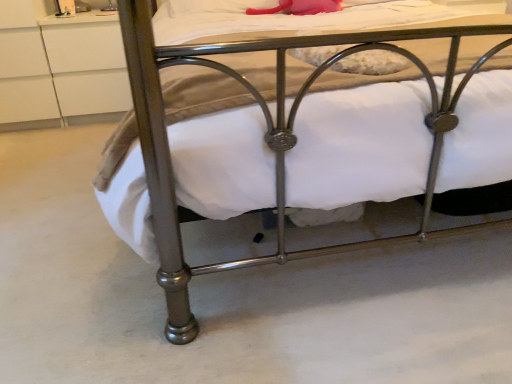
Where is `white matte drawer at upper left`? The height and width of the screenshot is (384, 512). white matte drawer at upper left is located at coordinates (87, 63).

What do you see at coordinates (87, 63) in the screenshot? I see `white matte drawer at upper left` at bounding box center [87, 63].

Describe the element at coordinates (265, 137) in the screenshot. The width and height of the screenshot is (512, 384). I see `metallic bed at lower center` at that location.

You are a GUI agent. You are given a task and a screenshot of the screen. Output one action in this format:
    pyautogui.click(x=<x>, y=<y>)
    Task: Click on the metallic bed at lower center
    This screenshot has height=384, width=512.
    Given the screenshot: What is the action you would take?
    pyautogui.click(x=265, y=137)

Locate an element on the screen. white matte drawer at upper left is located at coordinates (87, 63).

In the image, is metallic bed at lower center on the left side or the right side of white matte drawer at upper left?

Based on their positions, metallic bed at lower center is located to the right of white matte drawer at upper left.

Consider the image. Which object is further away from the camera taking this photo, metallic bed at lower center or white matte drawer at upper left?

Positioned behind is white matte drawer at upper left.

Between point (211, 267) and point (52, 51), which one is positioned behind?

The point (52, 51) is more distant.

From the image's perspective, which one is positioned higher, metallic bed at lower center or white matte drawer at upper left?

white matte drawer at upper left, from the image's perspective.

From a real-world perspective, is metallic bed at lower center above or below white matte drawer at upper left?

From a real-world perspective, metallic bed at lower center is physically above white matte drawer at upper left.

Can you confirm if metallic bed at lower center is wider than white matte drawer at upper left?

Indeed, metallic bed at lower center has a greater width compared to white matte drawer at upper left.

Which of these two, metallic bed at lower center or white matte drawer at upper left, stands taller?

metallic bed at lower center is taller.

Which of these two, metallic bed at lower center or white matte drawer at upper left, is bigger?

Bigger between the two is metallic bed at lower center.

Consider the image. Can we say metallic bed at lower center lies outside white matte drawer at upper left?

Yes, metallic bed at lower center is not within white matte drawer at upper left.

Is metallic bed at lower center far from white matte drawer at upper left?

Yes, metallic bed at lower center and white matte drawer at upper left are located far from each other.

Is metallic bed at lower center turned away from white matte drawer at upper left?

metallic bed at lower center is not turned away from white matte drawer at upper left.

Where is `bed below the white matte drawer at upper left (from the image's perspective)`? The image size is (512, 384). bed below the white matte drawer at upper left (from the image's perspective) is located at coordinates (265, 137).

In the scene shown: Which object is positioned more to the right, white matte drawer at upper left or metallic bed at lower center?

From the viewer's perspective, metallic bed at lower center appears more on the right side.

Relative to metallic bed at lower center, is white matte drawer at upper left in front or behind?

In the image, white matte drawer at upper left appears behind metallic bed at lower center.

Which point is more distant from viewer, (72, 97) or (432, 148)?

The point (72, 97) is more distant.

From the image's perspective, would you say white matte drawer at upper left is positioned over metallic bed at lower center?

Indeed, from the image's perspective, white matte drawer at upper left is shown above metallic bed at lower center.

From a real-world perspective, is white matte drawer at upper left under metallic bed at lower center?

Yes, from a real-world perspective, white matte drawer at upper left is under metallic bed at lower center.

Which of these two, white matte drawer at upper left or metallic bed at lower center, is thinner?

white matte drawer at upper left.

Who is shorter, white matte drawer at upper left or metallic bed at lower center?

white matte drawer at upper left is shorter.

Considering the sizes of objects white matte drawer at upper left and metallic bed at lower center in the image provided, who is smaller, white matte drawer at upper left or metallic bed at lower center?

white matte drawer at upper left.

Can we say white matte drawer at upper left lies outside metallic bed at lower center?

Yes.

Would you say white matte drawer at upper left is a long distance from metallic bed at lower center?

Yes, white matte drawer at upper left is far from metallic bed at lower center.

Is white matte drawer at upper left facing away from metallic bed at lower center?

No, white matte drawer at upper left is not facing the opposite direction of metallic bed at lower center.

What's the angular difference between white matte drawer at upper left and metallic bed at lower center's facing directions?

They differ by 1.53 degrees in their facing directions.

This screenshot has width=512, height=384. Find the location of `drawer that appears on the left of metallic bed at lower center`. drawer that appears on the left of metallic bed at lower center is located at coordinates (87, 63).

Identify the location of bed positioned vertically above the white matte drawer at upper left (from a real-world perspective). (265, 137).

Where is `bed below the white matte drawer at upper left (from the image's perspective)`? bed below the white matte drawer at upper left (from the image's perspective) is located at coordinates (265, 137).